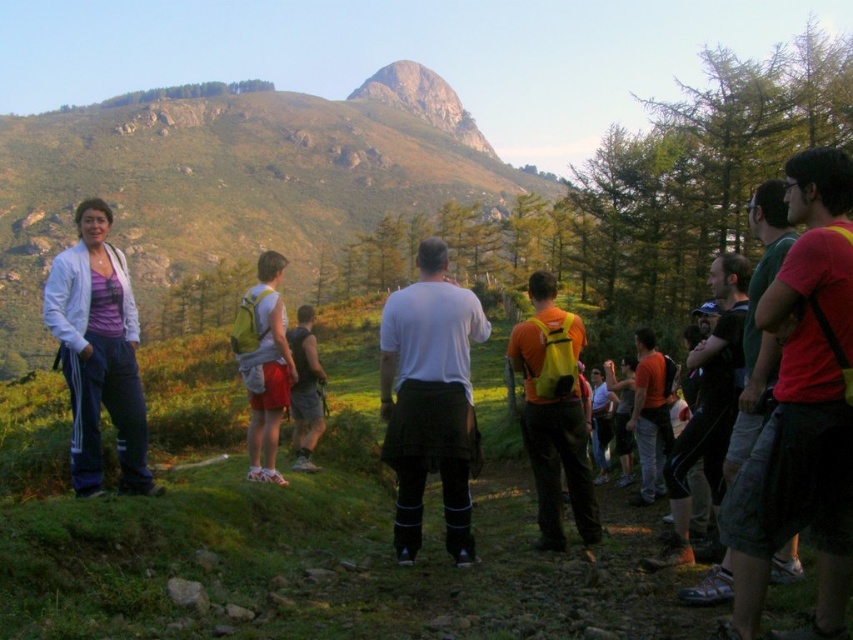
Which is behind, point (440, 429) or point (585, 496)?

Point (585, 496)

Does point (428, 332) come behind point (584, 474)?

Yes, it is.

At what (x,y) coordinates should I click in order to perform the action: click on white matte shirt at center. Please return your answer as a coordinate pair (x, y). Looking at the image, I should click on (428, 400).

Is point (386, 72) behind point (538, 284)?

Yes, it is behind point (538, 284).

This screenshot has width=853, height=640. In order to click on green grassy hillside at upper left in this screenshot , I will do `click(234, 179)`.

Is point (531, 275) closer to camera compared to point (642, 340)?

No, (531, 275) is behind (642, 340).

From the picture: Which of these two, yellow fabric backpack at center or orange fabric backpack at center-right, stands taller?

Standing taller between the two is yellow fabric backpack at center.

Which is in front, point (527, 422) or point (659, 483)?

Point (527, 422) is in front.

The width and height of the screenshot is (853, 640). Identify the location of yellow fabric backpack at center. (553, 417).